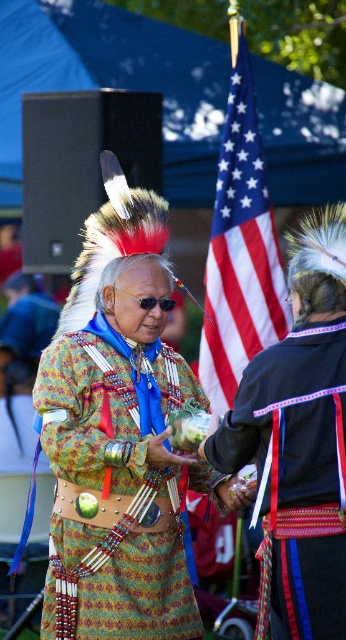
Can you confirm if american flag at center is bigger than patterned fabric headdress at center?

No, american flag at center is not bigger than patterned fabric headdress at center.

In the scene shown: Does american flag at center appear on the left side of patterned fabric headdress at center?

In fact, american flag at center is to the right of patterned fabric headdress at center.

Which is in front, point (280, 276) or point (2, 355)?

Point (280, 276) is more forward.

You are a GUI agent. You are given a task and a screenshot of the screen. Output one action in this format:
    pyautogui.click(x=<x>, y=<y>)
    Task: Click on the american flag at center
    
    Given the screenshot: What is the action you would take?
    pyautogui.click(x=240, y=248)

Does multicolored woven fabric at center have a smaller size compared to american flag at center?

No, multicolored woven fabric at center is not smaller than american flag at center.

Does multicolored woven fabric at center appear under american flag at center?

Yes.

Is point (62, 598) closer to viewer compared to point (260, 259)?

Yes, point (62, 598) is closer to viewer.

In order to click on multicolored woven fabric at center in this screenshot , I will do `click(113, 492)`.

Consider the image. Does shiny black headdress at center have a greater width compared to patterned fabric headdress at center?

Indeed, shiny black headdress at center has a greater width compared to patterned fabric headdress at center.

In the scene shown: Which is below, shiny black headdress at center or patterned fabric headdress at center?

shiny black headdress at center is lower down.

Measure the distance between shiny black headdress at center and camera.

The distance of shiny black headdress at center from camera is 24.19 feet.

At what (x,y) coordinates should I click in order to perform the action: click on shiny black headdress at center. Please return your answer as a coordinate pair (x, y). Looking at the image, I should click on (298, 442).